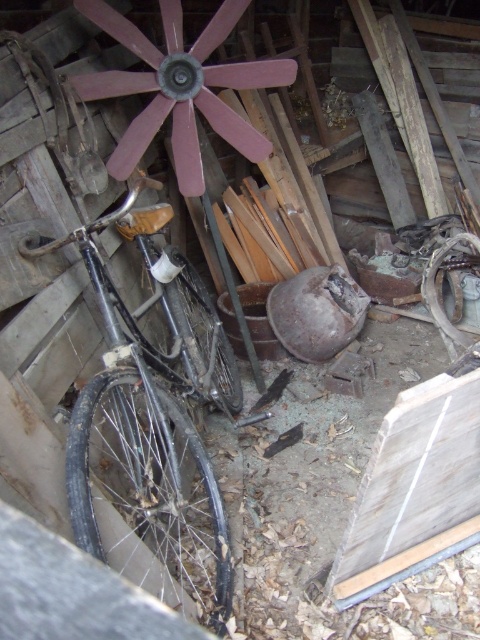
Question: Is black matte bicycle at left wider than rusty metal wagon wheel at center?

Choices:
 (A) yes
 (B) no

Answer: (A)

Question: Among these objects, which one is farthest from the camera?

Choices:
 (A) black matte bicycle at left
 (B) rusty metal wagon wheel at center
 (C) rustic metal wagon wheel at center

Answer: (B)

Question: Estimate the real-world distances between objects in this image. Which object is farther from the rustic metal wagon wheel at center?

Choices:
 (A) rusty metal wagon wheel at center
 (B) black matte bicycle at left

Answer: (A)

Question: Does black matte bicycle at left appear on the left side of rusty metal wagon wheel at center?

Choices:
 (A) yes
 (B) no

Answer: (A)

Question: Among these objects, which one is farthest from the camera?

Choices:
 (A) black matte bicycle at left
 (B) rusty metal wagon wheel at center
 (C) rustic metal wagon wheel at center

Answer: (B)

Question: Considering the relative positions of black matte bicycle at left and rusty metal wagon wheel at center in the image provided, where is black matte bicycle at left located with respect to rusty metal wagon wheel at center?

Choices:
 (A) right
 (B) left

Answer: (B)